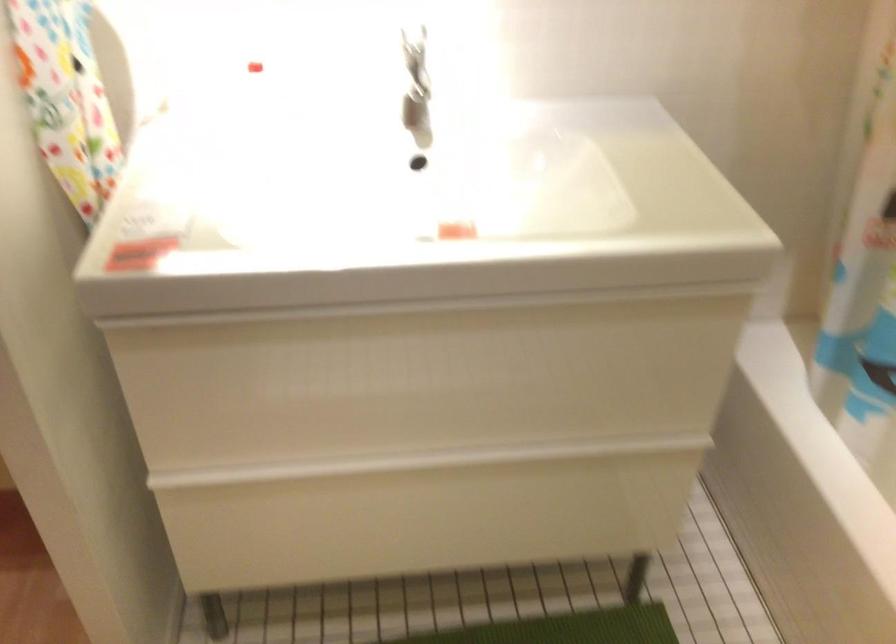
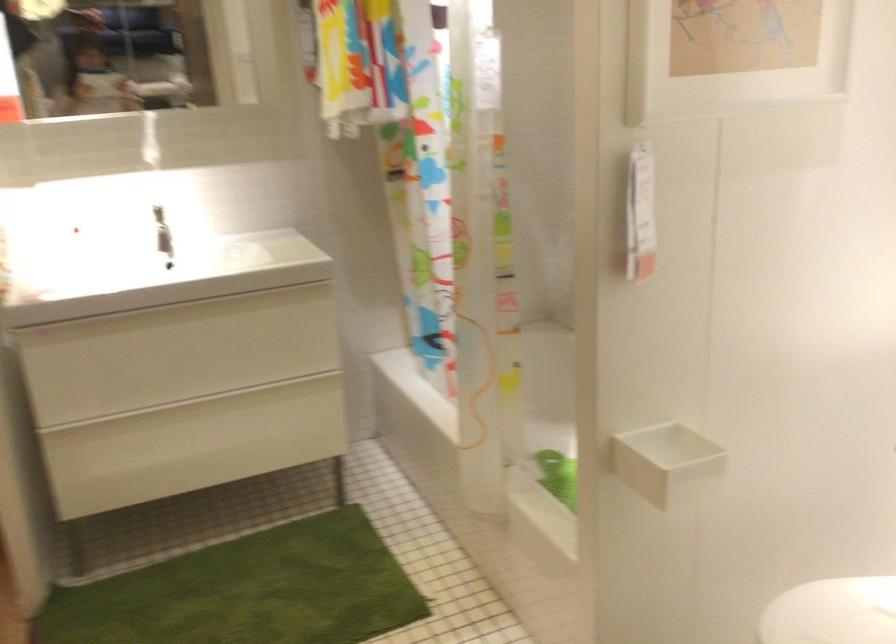
Question: The images are taken continuously from a first-person perspective. In which direction are you moving?

Choices:
 (A) Left
 (B) Right
 (C) Forward
 (D) Backward

Answer: (D)